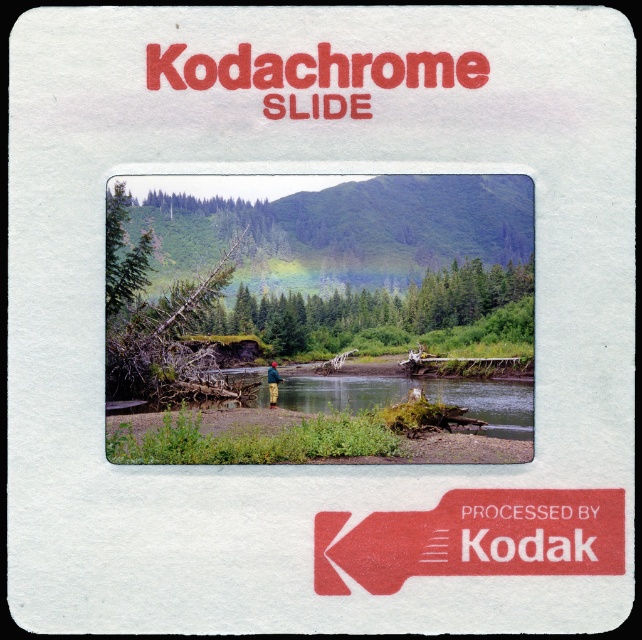
Question: Which object appears farthest from the camera in this image?

Choices:
 (A) green woolen hat at center
 (B) green grassy river at center

Answer: (A)

Question: Can you confirm if green grassy river at center is thinner than green woolen hat at center?

Choices:
 (A) yes
 (B) no

Answer: (B)

Question: Is green grassy river at center smaller than green woolen hat at center?

Choices:
 (A) yes
 (B) no

Answer: (B)

Question: Which point is farther to the camera?

Choices:
 (A) green grassy river at center
 (B) green woolen hat at center

Answer: (B)

Question: Observing the image, what is the correct spatial positioning of green grassy river at center in reference to green woolen hat at center?

Choices:
 (A) below
 (B) above

Answer: (B)

Question: Which point appears farthest from the camera in this image?

Choices:
 (A) (281, 400)
 (B) (270, 364)

Answer: (B)